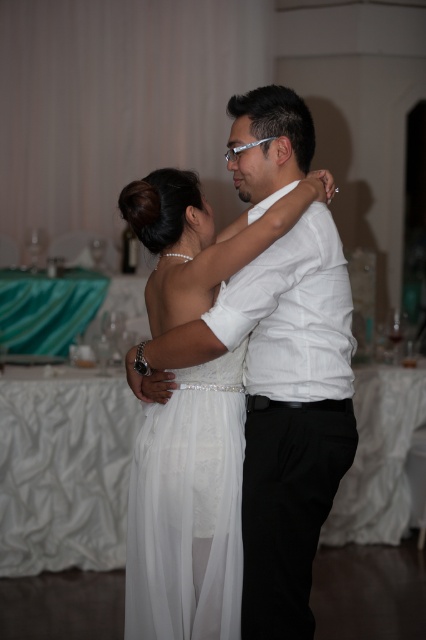
Question: Is white satin dress at center smaller than white sheer dress at center?

Choices:
 (A) no
 (B) yes

Answer: (A)

Question: Can you confirm if white satin dress at center is positioned to the right of white sheer dress at center?

Choices:
 (A) no
 (B) yes

Answer: (B)

Question: Is white satin dress at center above white sheer dress at center?

Choices:
 (A) yes
 (B) no

Answer: (A)

Question: Which point is farther from the camera taking this photo?

Choices:
 (A) (236, 573)
 (B) (166, 566)

Answer: (B)